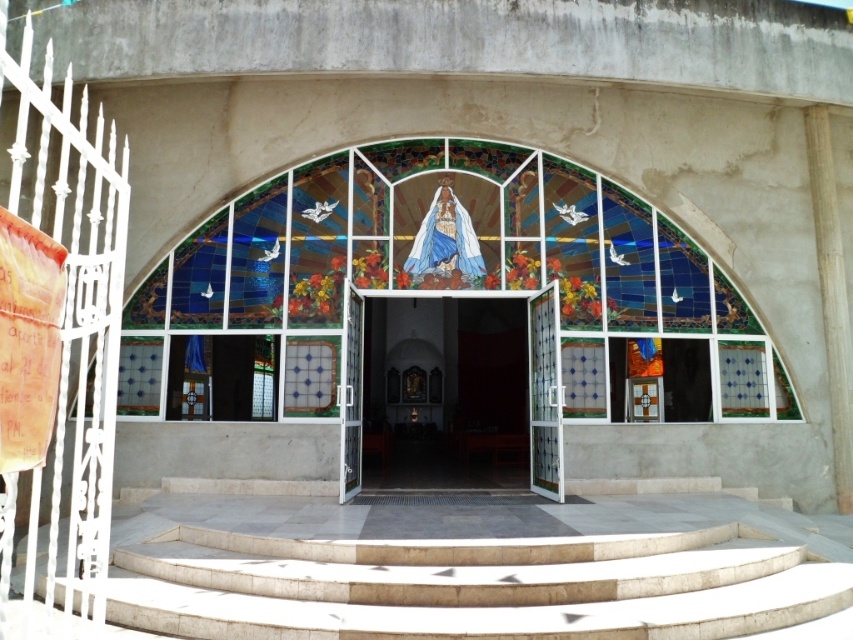
You are standing at the entrance of the religious structure and want to see both the stained glass mosaic at center and the white glass doors at center. Which object is positioned lower in the image?

The stained glass mosaic at center is located below the white glass doors at center, so it is positioned lower in the image.

You are standing at the entrance of the religious structure and want to enter. Which object, the white stone stairs at center or the stained glass mosaic at center, is located above the other?

The white stone stairs at center is positioned under the stained glass mosaic at center, so the stained glass mosaic at center is above the white stone stairs at center.